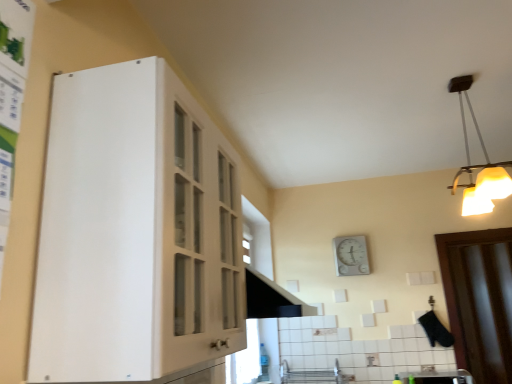
Question: In the image, is white plastic light fixture at upper right positioned in front of or behind white plastic clock at upper center?

Choices:
 (A) behind
 (B) front

Answer: (B)

Question: From a real-world perspective, is white plastic light fixture at upper right physically located above or below white plastic clock at upper center?

Choices:
 (A) above
 (B) below

Answer: (A)

Question: Which is farther from the white glossy sink at lower right?

Choices:
 (A) white matte cabinet at left
 (B) brown wooden door at right
 (C) white plastic clock at upper center
 (D) white plastic light fixture at upper right

Answer: (A)

Question: Considering the real-world distances, which object is closest to the white matte cabinet at left?

Choices:
 (A) brown wooden door at right
 (B) white glossy sink at lower right
 (C) white plastic light fixture at upper right
 (D) white plastic clock at upper center

Answer: (C)